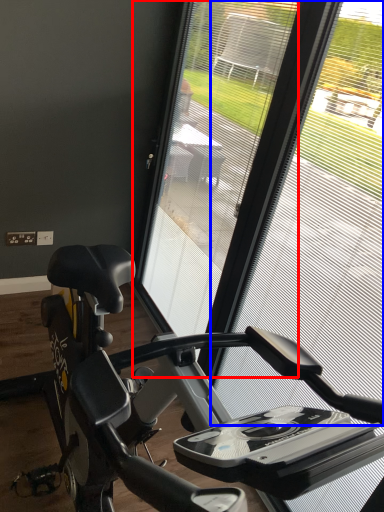
Question: Among these objects, which one is nearest to the camera, screen door (highlighted by a red box) or window screen (highlighted by a blue box)?

Choices:
 (A) screen door
 (B) window screen

Answer: (B)